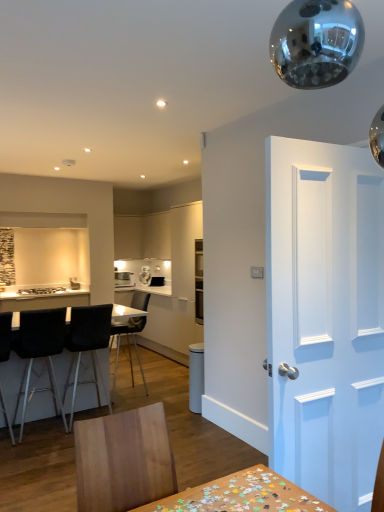
Question: Is matte white cabinet at center, the 2th cabinetry positioned from the right, positioned beyond the bounds of black matte chair at center, which is the 1th chair from back to front?

Choices:
 (A) yes
 (B) no

Answer: (A)

Question: Is matte white cabinet at center, which is counted as the 1th cabinetry, starting from the left, next to black matte chair at center, positioned as the fourth chair in front-to-back order?

Choices:
 (A) no
 (B) yes

Answer: (A)

Question: From the image's perspective, is matte white cabinet at center, which is counted as the 1th cabinetry, starting from the left, located beneath black matte chair at center, which is the 1th chair from back to front?

Choices:
 (A) yes
 (B) no

Answer: (B)

Question: Is there a large distance between matte white cabinet at center, which is counted as the 1th cabinetry, starting from the left, and black matte chair at center, positioned as the fourth chair in front-to-back order?

Choices:
 (A) yes
 (B) no

Answer: (A)

Question: Is matte white cabinet at center, the 2th cabinetry positioned from the right, in front of black matte chair at center, positioned as the fourth chair in front-to-back order?

Choices:
 (A) yes
 (B) no

Answer: (B)

Question: From the image's perspective, is black matte chair at center, positioned as the fourth chair in front-to-back order, above or below black leather chair at left, positioned as the 1th chair in front-to-back order?

Choices:
 (A) below
 (B) above

Answer: (B)

Question: From a real-world perspective, relative to black leather chair at left, which is the 4th chair from back to front, is black matte chair at center, positioned as the fourth chair in front-to-back order, vertically above or below?

Choices:
 (A) below
 (B) above

Answer: (A)

Question: Is black matte chair at center, which is the 1th chair from back to front, spatially inside black leather chair at left, positioned as the 1th chair in front-to-back order, or outside of it?

Choices:
 (A) inside
 (B) outside

Answer: (B)

Question: Looking at their shapes, would you say black matte chair at center, which is the 1th chair from back to front, is wider or thinner than black leather chair at left, positioned as the 1th chair in front-to-back order?

Choices:
 (A) thin
 (B) wide

Answer: (A)

Question: From the image's perspective, is black leather chair at left, which is the 4th chair from back to front, located above or below black fabric chair at left, acting as the 3th chair starting from the back?

Choices:
 (A) below
 (B) above

Answer: (A)

Question: Is black leather chair at left, positioned as the 1th chair in front-to-back order, wider or thinner than black fabric chair at left, the second chair in the front-to-back sequence?

Choices:
 (A) wide
 (B) thin

Answer: (A)

Question: In the image, is black leather chair at left, which is the 4th chair from back to front, on the left side or the right side of black fabric chair at left, the second chair in the front-to-back sequence?

Choices:
 (A) right
 (B) left

Answer: (B)

Question: From a real-world perspective, is black leather chair at left, positioned as the 1th chair in front-to-back order, above or below black fabric chair at left, acting as the 3th chair starting from the back?

Choices:
 (A) above
 (B) below

Answer: (A)

Question: In terms of height, does black fabric chair at left, the second chair in the front-to-back sequence, look taller or shorter compared to white matte door at right?

Choices:
 (A) tall
 (B) short

Answer: (B)

Question: Is point (26, 325) positioned closer to the camera than point (364, 358)?

Choices:
 (A) closer
 (B) farther

Answer: (B)